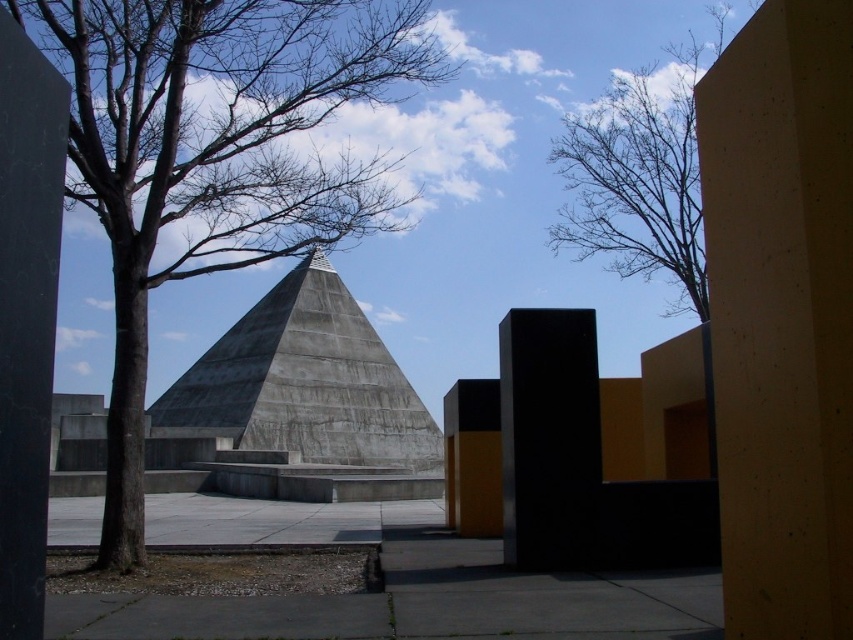
Does bare branches at upper right have a greater width compared to black matte pillar at center?

Yes.

From the picture: Measure the distance between bare branches at upper right and camera.

A distance of 275.74 feet exists between bare branches at upper right and camera.

Where is `bare branches at upper right`? The width and height of the screenshot is (853, 640). bare branches at upper right is located at coordinates (639, 173).

This screenshot has width=853, height=640. What do you see at coordinates (215, 154) in the screenshot?
I see `brown leafless tree at left` at bounding box center [215, 154].

Does point (264, 92) lie behind point (554, 465)?

Yes, it is.

The height and width of the screenshot is (640, 853). Find the location of `brown leafless tree at left`. brown leafless tree at left is located at coordinates click(215, 154).

Which of these two, brown leafless tree at left or black polished pillar at left, stands taller?

brown leafless tree at left is taller.

Is brown leafless tree at left smaller than black polished pillar at left?

Actually, brown leafless tree at left might be larger than black polished pillar at left.

Image resolution: width=853 pixels, height=640 pixels. Describe the element at coordinates (215, 154) in the screenshot. I see `brown leafless tree at left` at that location.

The width and height of the screenshot is (853, 640). I want to click on brown leafless tree at left, so click(215, 154).